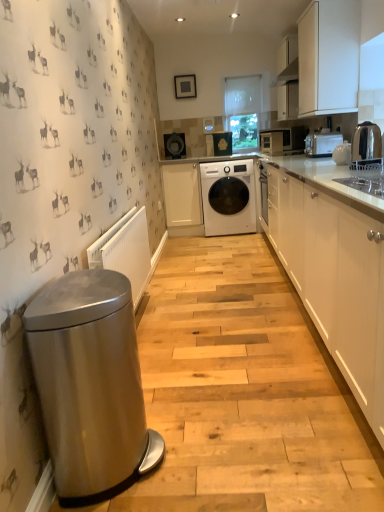
In order to click on free location in front of white plastic radiator at lower left in this screenshot , I will do `click(191, 378)`.